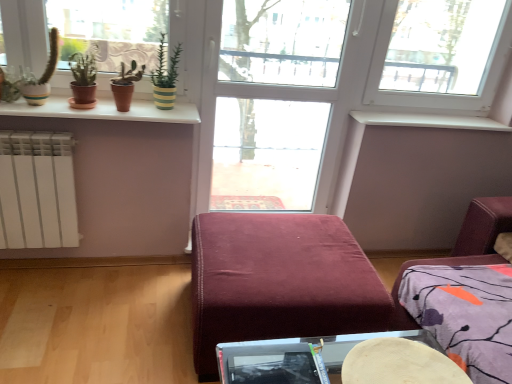
Describe the element at coordinates (274, 101) in the screenshot. The image size is (512, 384). I see `transparent glass door at center` at that location.

The height and width of the screenshot is (384, 512). I want to click on white glossy window sill at upper left, acting as the second window sill starting from the right, so click(x=104, y=111).

The width and height of the screenshot is (512, 384). Describe the element at coordinates (297, 357) in the screenshot. I see `wooden round table at lower center` at that location.

Image resolution: width=512 pixels, height=384 pixels. Identify the location of velvet burgundy ottoman at center. (280, 282).

The width and height of the screenshot is (512, 384). What do you see at coordinates (280, 282) in the screenshot?
I see `velvet burgundy ottoman at center` at bounding box center [280, 282].

Describe the element at coordinates (440, 55) in the screenshot. I see `white plastic window at upper right` at that location.

Locate an element on the screen. transparent glass door at center is located at coordinates (274, 101).

From a real-world perspective, is velvet burgundy ottoman at center located higher than wooden round table at lower center?

No, from a real-world perspective, velvet burgundy ottoman at center is not on top of wooden round table at lower center.

From the image's perspective, is velvet burgundy ottoman at center on top of wooden round table at lower center?

Yes, from the image's perspective, velvet burgundy ottoman at center is on top of wooden round table at lower center.

Is velvet burgundy ottoman at center outside of wooden round table at lower center?

Absolutely, velvet burgundy ottoman at center is external to wooden round table at lower center.

From a real-world perspective, between wooden round table at lower center and transparent glass door at center, who is vertically higher?

transparent glass door at center is physically above.

Is wooden round table at lower center outside of transparent glass door at center?

Yes, wooden round table at lower center is not within transparent glass door at center.

Which of these two, wooden round table at lower center or transparent glass door at center, is thinner?

With smaller width is transparent glass door at center.

Is wooden round table at lower center not near transparent glass door at center?

wooden round table at lower center is positioned a significant distance from transparent glass door at center.

Is point (401, 33) closer to camera compared to point (175, 64)?

No.

From their relative heights in the image, would you say white plastic window at upper right is taller or shorter than green striped pot at upper center?

white plastic window at upper right is taller than green striped pot at upper center.

Would you say white plastic window at upper right is to the left or to the right of green striped pot at upper center in the picture?

In the image, white plastic window at upper right appears on the right side of green striped pot at upper center.

From a real-world perspective, who is located lower, velvet burgundy ottoman at center or green striped pot at upper center?

velvet burgundy ottoman at center.

Is green striped pot at upper center surrounded by velvet burgundy ottoman at center?

No.

Locate an element on the screen. The image size is (512, 384). plant behind the velvet burgundy ottoman at center is located at coordinates (168, 67).

In the image, is white glossy window sill at upper left, acting as the second window sill starting from the right, positioned in front of or behind transparent glass door at center?

white glossy window sill at upper left, acting as the second window sill starting from the right, is in front of transparent glass door at center.

Choose the correct answer: Is white glossy window sill at upper left, the second window sill from the back, inside transparent glass door at center or outside it?

white glossy window sill at upper left, the second window sill from the back, is not enclosed by transparent glass door at center.

From a real-world perspective, is white glossy window sill at upper left, the second window sill from the back, physically above transparent glass door at center?

Yes, from a real-world perspective, white glossy window sill at upper left, the second window sill from the back, is on top of transparent glass door at center.

From the image's perspective, relative to white glossy window sill at upper left, which ranks as the first window sill in front-to-back order, is white plastic window at upper right above or below?

From the image's perspective, white plastic window at upper right appears above white glossy window sill at upper left, which ranks as the first window sill in front-to-back order.

From a real-world perspective, between white plastic window at upper right and white glossy window sill at upper left, positioned as the 1th window sill in left-to-right order, who is vertically lower?

white glossy window sill at upper left, positioned as the 1th window sill in left-to-right order, is physically lower.

Between point (401, 71) and point (23, 106), which one is positioned behind?

The point (401, 71) is farther.

Is green striped pot at upper center wider or thinner than wooden round table at lower center?

Clearly, green striped pot at upper center has less width compared to wooden round table at lower center.

Based on the photo, considering the relative positions of green striped pot at upper center and wooden round table at lower center in the image provided, is green striped pot at upper center to the right of wooden round table at lower center from the viewer's perspective?

In fact, green striped pot at upper center is to the left of wooden round table at lower center.

From a real-world perspective, is green striped pot at upper center located beneath wooden round table at lower center?

Actually, green striped pot at upper center is physically above wooden round table at lower center in the real world.

Considering the relative sizes of green striped pot at upper center and wooden round table at lower center in the image provided, is green striped pot at upper center bigger than wooden round table at lower center?

Correct, green striped pot at upper center is larger in size than wooden round table at lower center.

Where is `furniture that is behind the wooden round table at lower center`? furniture that is behind the wooden round table at lower center is located at coordinates (280, 282).

Where is `table that is in front of the transparent glass door at center`? The height and width of the screenshot is (384, 512). table that is in front of the transparent glass door at center is located at coordinates (297, 357).

Considering their positions, is wooden round table at lower center positioned further to white plastic window at upper right than green striped pot at upper center?

wooden round table at lower center lies further to white plastic window at upper right than the other object.

Considering their positions, is white smooth window sill at upper center, which is counted as the first window sill, starting from the back, positioned further to white plastic window at upper right than green striped pot at upper center?

The object further to white plastic window at upper right is green striped pot at upper center.

Considering their positions, is white smooth window sill at upper center, which is counted as the first window sill, starting from the right, positioned further to green striped pot at upper center than wooden round table at lower center?

wooden round table at lower center is further to green striped pot at upper center.

From the image, which object appears to be farther from white plastic window at upper right, velvet burgundy ottoman at center or green striped pot at upper center?

green striped pot at upper center is further to white plastic window at upper right.

Based on their spatial positions, is green striped pot at upper center or wooden round table at lower center closer to transparent glass door at center?

Based on the image, green striped pot at upper center appears to be nearer to transparent glass door at center.

Which object lies further to the anchor point wooden round table at lower center, white plastic window at upper right or white glossy window sill at upper left, which ranks as the first window sill in front-to-back order?

white plastic window at upper right is further to wooden round table at lower center.

When comparing their distances from wooden round table at lower center, does white smooth window sill at upper center, which is counted as the first window sill, starting from the back, or transparent glass door at center seem closer?

white smooth window sill at upper center, which is counted as the first window sill, starting from the back, is positioned closer to the anchor wooden round table at lower center.

Which object lies further to the anchor point white smooth window sill at upper center, which is counted as the first window sill, starting from the right, white glossy window sill at upper left, which ranks as the first window sill in front-to-back order, or white plastic window at upper right?

white glossy window sill at upper left, which ranks as the first window sill in front-to-back order, lies further to white smooth window sill at upper center, which is counted as the first window sill, starting from the right, than the other object.

You are a GUI agent. You are given a task and a screenshot of the screen. Output one action in this format:
    pyautogui.click(x=<x>, y=<y>)
    Task: Click on the furniture situated between white glossy window sill at upper left, acting as the second window sill starting from the right, and wooden round table at lower center from left to right
    The height and width of the screenshot is (384, 512).
    Given the screenshot: What is the action you would take?
    pyautogui.click(x=280, y=282)

Identify the location of furniture between green striped pot at upper center and wooden round table at lower center in the vertical direction. Image resolution: width=512 pixels, height=384 pixels. (280, 282).

Locate an element on the screen. table located between green striped pot at upper center and white smooth window sill at upper center, which is counted as the first window sill, starting from the back, in the left-right direction is located at coordinates (297, 357).

Where is `glass door situated between white glossy window sill at upper left, which ranks as the first window sill in front-to-back order, and wooden round table at lower center from left to right`? glass door situated between white glossy window sill at upper left, which ranks as the first window sill in front-to-back order, and wooden round table at lower center from left to right is located at coordinates (274, 101).